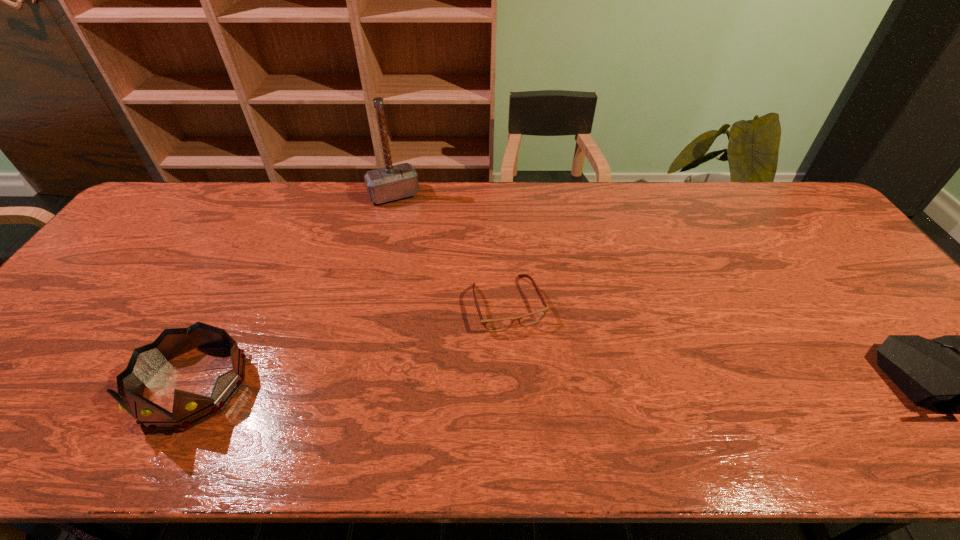
Where is `free space between the second shortest object and the third nearest object`? This screenshot has width=960, height=540. free space between the second shortest object and the third nearest object is located at coordinates (351, 345).

Where is `unoccupied area between the shortest object and the hammer`? The height and width of the screenshot is (540, 960). unoccupied area between the shortest object and the hammer is located at coordinates (451, 249).

You are a GUI agent. You are given a task and a screenshot of the screen. Output one action in this format:
    pyautogui.click(x=<x>, y=<y>)
    Task: Click on the empty location between the hammer and the tiara
    The image size is (960, 540).
    Given the screenshot: What is the action you would take?
    pyautogui.click(x=294, y=291)

At what (x,y) coordinates should I click in order to perform the action: click on object that is the second closest to the second farthest object. Please return your answer as a coordinate pair (x, y). Image resolution: width=960 pixels, height=540 pixels. Looking at the image, I should click on (189, 410).

Locate which object ranks second in proximity to the leftmost object. Please provide its 2D coordinates. Your answer should be formatted as a tuple, i.e. [(x, y)], where the tuple contains the x and y coordinates of a point satisfying the conditions above.

[(390, 183)]